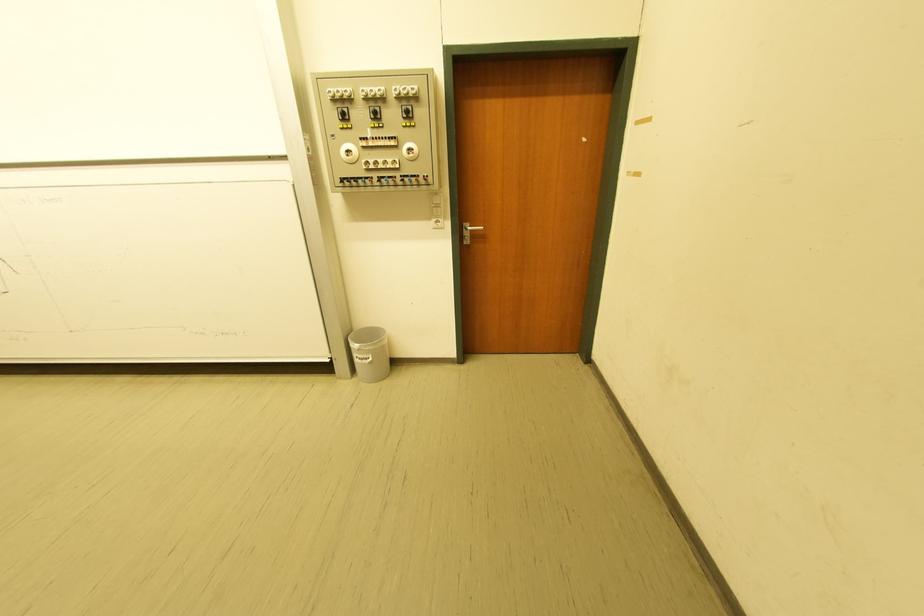
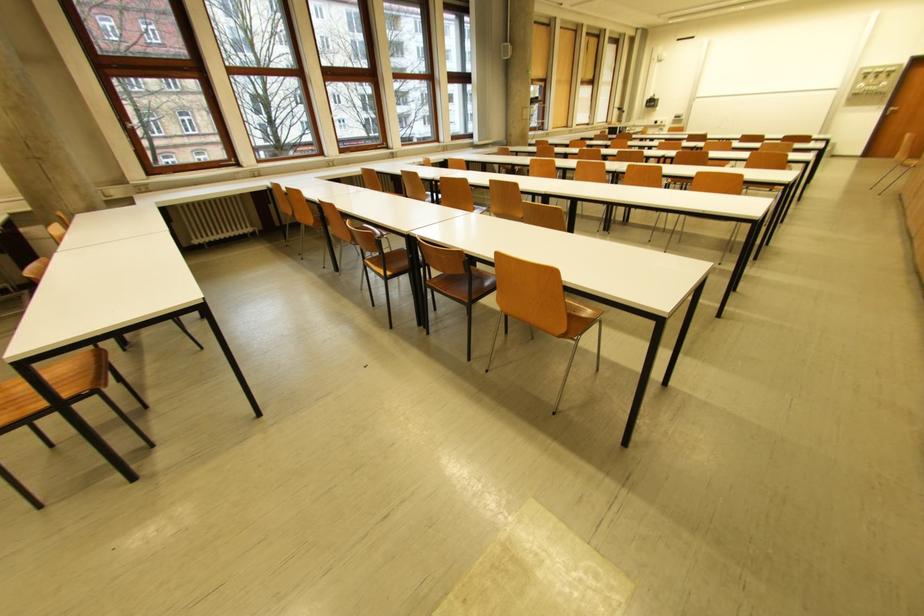
In the second image, find the point that corresponds to (455,225) in the first image.

(891, 108)